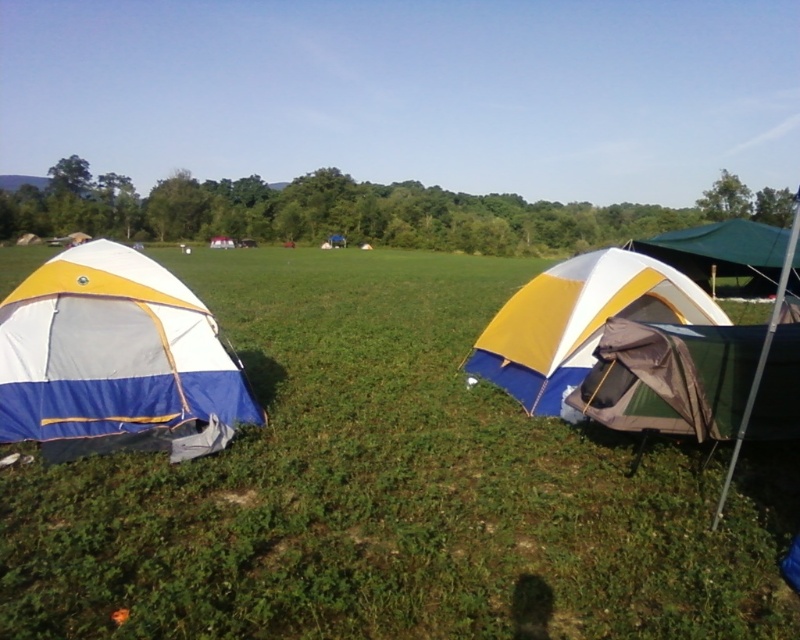
This screenshot has height=640, width=800. What do you see at coordinates (578, 321) in the screenshot? I see `yellow/white fabric tent at center-right` at bounding box center [578, 321].

Locate an element on the screen. This screenshot has width=800, height=640. yellow/white fabric tent at center-right is located at coordinates (578, 321).

Which is below, green grassy at center or yellow/white fabric tent at center-right?

yellow/white fabric tent at center-right is below.

Does green grassy at center have a larger size compared to yellow/white fabric tent at center-right?

Correct, green grassy at center is larger in size than yellow/white fabric tent at center-right.

Between point (796, 472) and point (662, 285), which one is positioned behind?

Point (662, 285)

Locate an element on the screen. This screenshot has height=640, width=800. green grassy at center is located at coordinates (392, 490).

Who is positioned more to the right, blue and white canvas tent at left or green fabric tent at right?

green fabric tent at right

Is blue and white canvas tent at left above green fabric tent at right?

Incorrect, blue and white canvas tent at left is not positioned above green fabric tent at right.

Describe the element at coordinates (112, 356) in the screenshot. I see `blue and white canvas tent at left` at that location.

In order to click on blue and white canvas tent at left in this screenshot , I will do `click(112, 356)`.